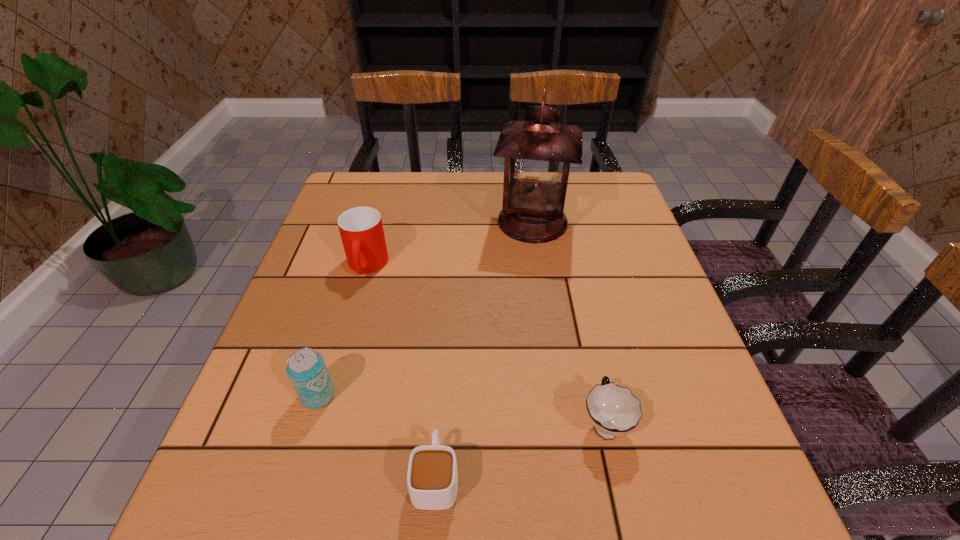
The width and height of the screenshot is (960, 540). Identify the location of blank space located on the side of the rightmost cup with the handle. (583, 324).

This screenshot has width=960, height=540. In order to click on free location located 0.310m on the side of the rightmost cup with the handle in this screenshot , I will do `click(572, 279)`.

The image size is (960, 540). I want to click on free space located on the side with the handle of the second cup from left to right, so click(444, 370).

You are a GUI agent. You are given a task and a screenshot of the screen. Output one action in this format:
    pyautogui.click(x=<x>, y=<y>)
    Task: Click on the free space located on the side with the handle of the second cup from left to right
    
    Given the screenshot: What is the action you would take?
    pyautogui.click(x=447, y=319)

Locate an element on the screen. The height and width of the screenshot is (540, 960). vacant space located 0.230m on the side with the handle of the second cup from left to right is located at coordinates (445, 338).

At what (x,y) coordinates should I click in order to perform the action: click on object situated at the far edge. Please return your answer as a coordinate pair (x, y). The image size is (960, 540). Looking at the image, I should click on (538, 152).

The height and width of the screenshot is (540, 960). I want to click on object that is at the near edge, so click(x=432, y=478).

The width and height of the screenshot is (960, 540). In order to click on cup present at the left edge in this screenshot , I will do `click(361, 229)`.

Where is `beer can located in the left edge section of the desktop`? This screenshot has width=960, height=540. beer can located in the left edge section of the desktop is located at coordinates (306, 369).

Locate an element on the screen. This screenshot has height=540, width=960. vacant region at the near edge is located at coordinates (392, 495).